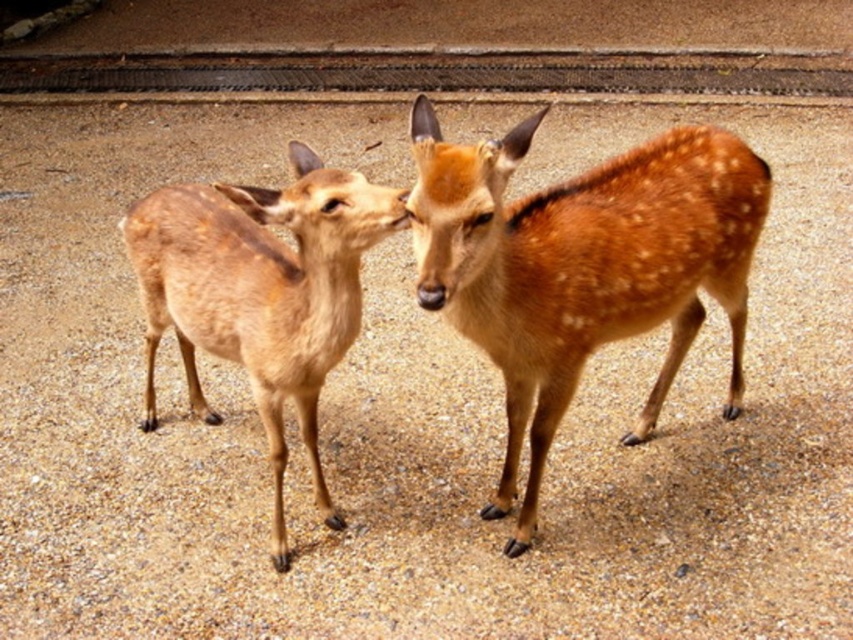
Question: Which point is closer to the camera taking this photo?

Choices:
 (A) (553, 225)
 (B) (318, 364)

Answer: (B)

Question: Among these objects, which one is farthest from the camera?

Choices:
 (A) sandy brown fur at center
 (B) brown speckled fur at center

Answer: (B)

Question: From the image, what is the correct spatial relationship of sandy brown fur at center in relation to brown speckled fur at center?

Choices:
 (A) above
 (B) below

Answer: (A)

Question: Considering the relative positions of sandy brown fur at center and brown speckled fur at center in the image provided, where is sandy brown fur at center located with respect to brown speckled fur at center?

Choices:
 (A) right
 (B) left

Answer: (A)

Question: Can you confirm if sandy brown fur at center is bigger than brown speckled fur at center?

Choices:
 (A) yes
 (B) no

Answer: (A)

Question: Which point is farther to the camera?

Choices:
 (A) brown speckled fur at center
 (B) sandy brown fur at center

Answer: (A)